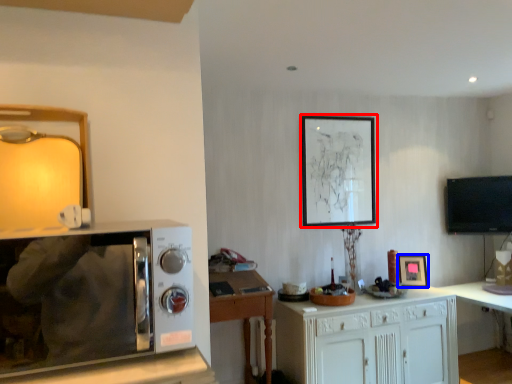
Question: Which of the following is the farthest to the observer, picture frame (highlighted by a red box) or picture frame (highlighted by a blue box)?

Choices:
 (A) picture frame
 (B) picture frame

Answer: (A)